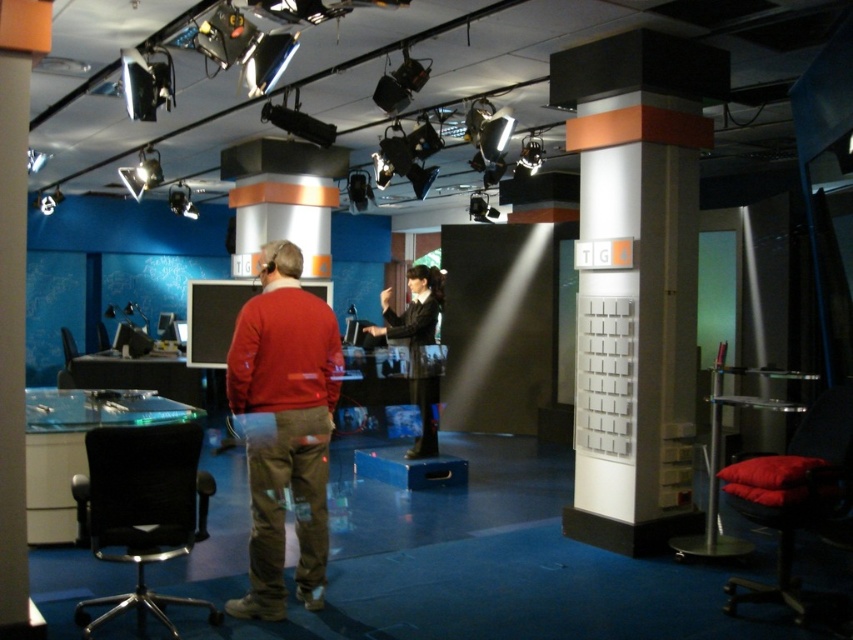
Is white plastic pillar at center smaller than matte red sweater at center?

Actually, white plastic pillar at center might be larger than matte red sweater at center.

Who is more distant from viewer, (691, 172) or (312, 550)?

The point (691, 172) is behind.

Is point (595, 275) closer to viewer compared to point (263, 296)?

No, it is behind (263, 296).

Image resolution: width=853 pixels, height=640 pixels. I want to click on white plastic pillar at center, so click(x=637, y=280).

Does matte red sweater at center appear on the left side of black mesh swivel chair at lower left?

Incorrect, matte red sweater at center is not on the left side of black mesh swivel chair at lower left.

Based on the photo, who is taller, matte red sweater at center or black mesh swivel chair at lower left?

matte red sweater at center

Identify the location of matte red sweater at center. This screenshot has height=640, width=853. (283, 428).

Who is positioned more to the left, white plastic pillar at center or black mesh swivel chair at lower left?

black mesh swivel chair at lower left is more to the left.

Is point (634, 376) positioned before point (160, 515)?

No, (634, 376) is behind (160, 515).

Where is `white plastic pillar at center`? The image size is (853, 640). white plastic pillar at center is located at coordinates (637, 280).